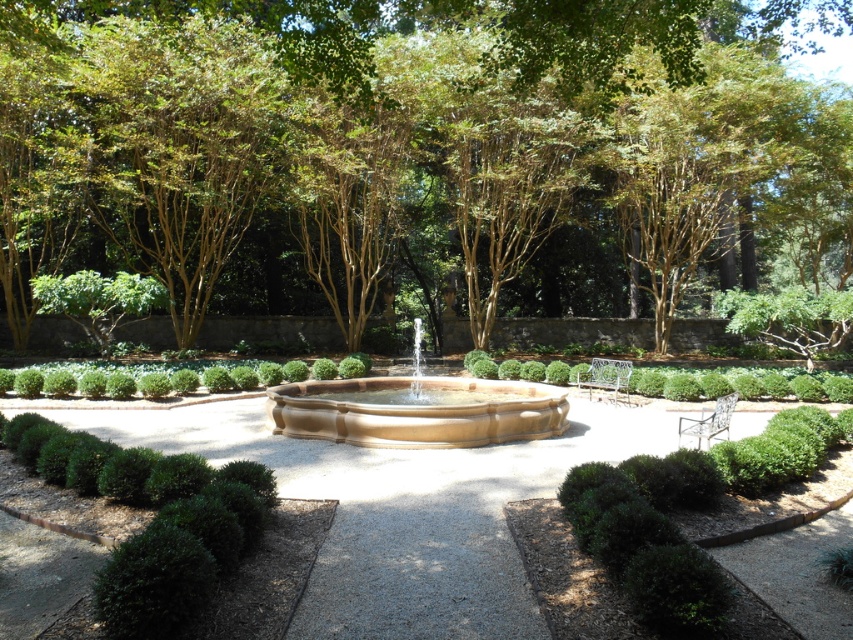
Question: Does brown smooth tree at upper center appear over green bushy hedge at lower left?

Choices:
 (A) yes
 (B) no

Answer: (A)

Question: Which point appears closest to the camera in this image?

Choices:
 (A) (260, 502)
 (B) (349, 32)

Answer: (A)

Question: Among these points, which one is farthest from the camera?

Choices:
 (A) (367, 436)
 (B) (175, 392)
 (C) (183, 228)

Answer: (C)

Question: Can you confirm if matte stone fountain at center is positioned below green textured hedge at center?

Choices:
 (A) no
 (B) yes

Answer: (B)

Question: Which of the following is the closest to the observer?

Choices:
 (A) (558, 435)
 (B) (531, 83)
 (C) (42, 388)
 (D) (131, 492)

Answer: (D)

Question: From the image, what is the correct spatial relationship of matte stone fountain at center in relation to green textured hedge at center?

Choices:
 (A) above
 (B) below

Answer: (B)